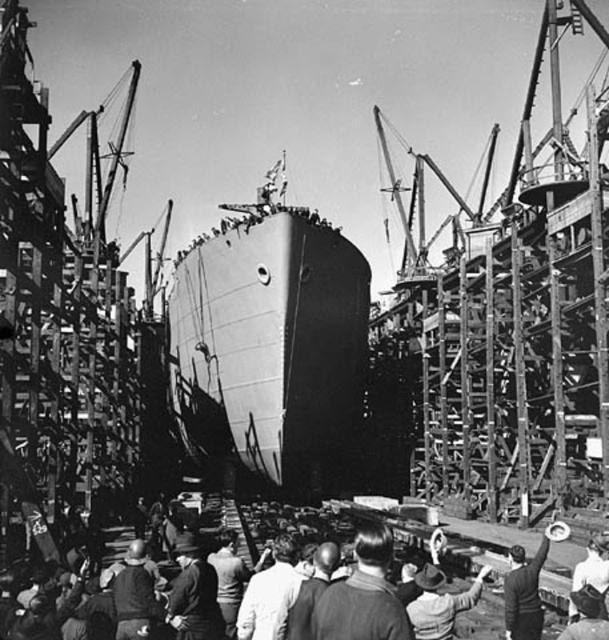
Question: Which point is farther to the camera?

Choices:
 (A) light gray fabric jacket at center
 (B) dark gray shirt at center

Answer: (A)

Question: Does white cloth hat at center appear over dark brown leather hat at center?

Choices:
 (A) no
 (B) yes

Answer: (B)

Question: Where is dark clothing crowd at lower left located in relation to light gray fabric jacket at center in the image?

Choices:
 (A) below
 (B) above

Answer: (A)

Question: Which object is positioned closest to the light gray fabric jacket at center?

Choices:
 (A) dark gray shirt at center
 (B) white cotton shirt at center
 (C) smooth gray ship at center

Answer: (A)

Question: Can you confirm if dark clothing crowd at lower left is positioned to the left of white cloth hat at center?

Choices:
 (A) no
 (B) yes

Answer: (B)

Question: Among these points, which one is farthest from the camera?

Choices:
 (A) (367, 540)
 (B) (532, 579)
 (C) (481, 552)

Answer: (C)